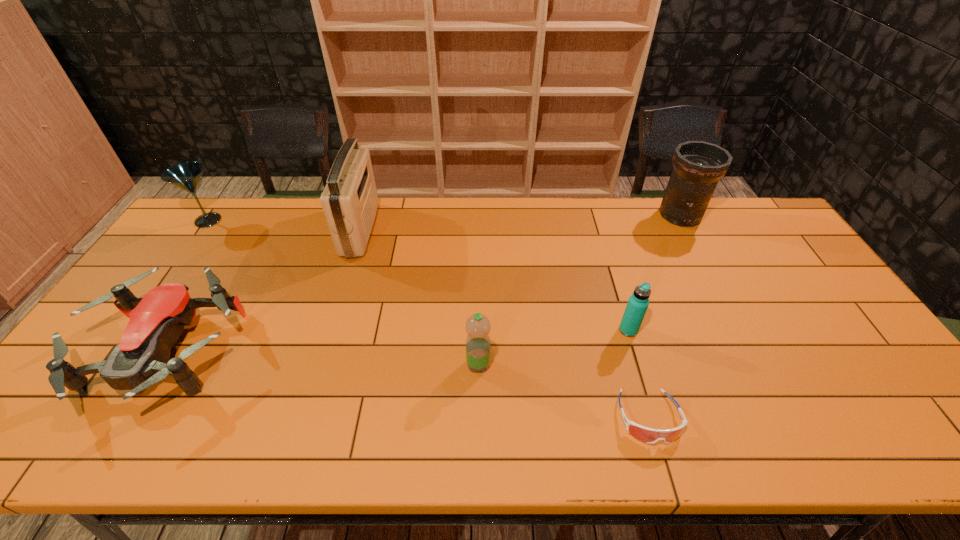
The height and width of the screenshot is (540, 960). In order to click on radio receiver in this screenshot , I will do `click(349, 200)`.

The image size is (960, 540). I want to click on telephoto lens, so click(x=697, y=165).

The height and width of the screenshot is (540, 960). I want to click on the rightmost object, so point(697,165).

The height and width of the screenshot is (540, 960). What are the coordinates of `martini` in the screenshot? It's located at (186, 175).

This screenshot has width=960, height=540. Find the location of `the nearer water bottle`. the nearer water bottle is located at coordinates (478, 346).

Locate an element on the screen. the left water bottle is located at coordinates (478, 346).

Where is `the farther water bottle`? the farther water bottle is located at coordinates (638, 302).

You are a GUI agent. You are given a task and a screenshot of the screen. Output one action in this format:
    pyautogui.click(x=<x>, y=<y>)
    Task: Click on the second shortest object
    The height and width of the screenshot is (540, 960).
    Given the screenshot: What is the action you would take?
    pyautogui.click(x=141, y=359)

This screenshot has width=960, height=540. I want to click on goggles, so click(648, 435).

Find the location of `free space located on the front-facing side of the fifth object from right to left`. free space located on the front-facing side of the fifth object from right to left is located at coordinates (419, 230).